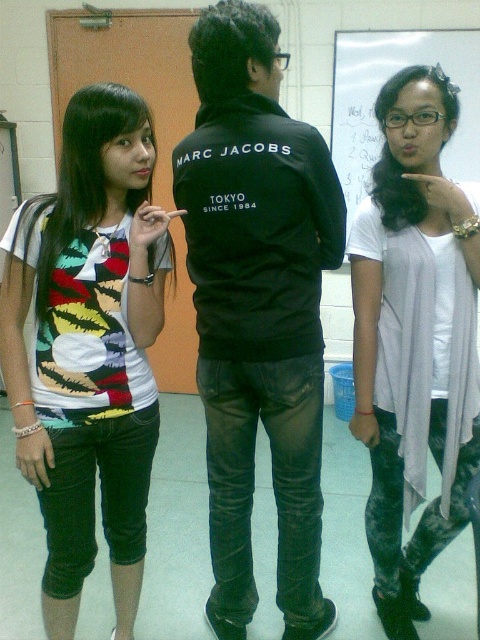
Question: Which of the following is the farthest from the observer?

Choices:
 (A) (400, 280)
 (B) (228, 413)
 (C) (66, 625)

Answer: (B)

Question: Can you confirm if light gray sheer cardigan at center is positioned to the left of white paper at upper center?

Choices:
 (A) yes
 (B) no

Answer: (A)

Question: Which point is farther from the camera taking this photo?

Choices:
 (A) (334, 116)
 (B) (321, 337)
 (C) (126, 515)

Answer: (A)

Question: Based on their relative distances, which object is nearer to the white paper at upper center?

Choices:
 (A) light gray sheer cardigan at center
 (B) multicolored printed t-shirt at left

Answer: (A)

Question: From the image, what is the correct spatial relationship of multicolored printed t-shirt at left in relation to white paper at upper center?

Choices:
 (A) left
 (B) right

Answer: (A)

Question: From the image, what is the correct spatial relationship of multicolored printed t-shirt at left in relation to light gray sheer cardigan at center?

Choices:
 (A) right
 (B) left

Answer: (B)